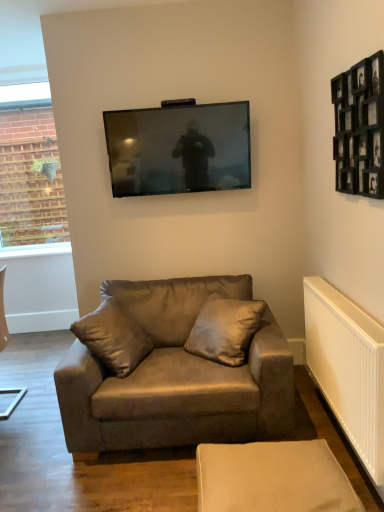
Find the location of a particular element. The height and width of the screenshot is (512, 384). free space between beige fabric ottoman at lower center and suede brown couch at center is located at coordinates (144, 483).